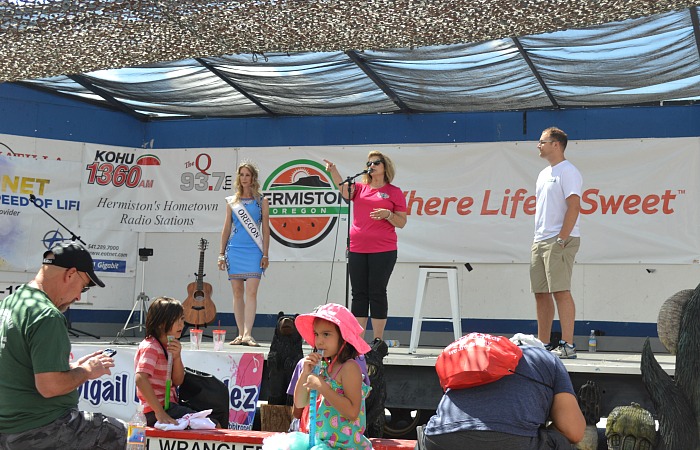
Find the location of a particular element. Image resolution: width=700 pixels, height=450 pixels. see thru ceiling fabric is located at coordinates (314, 81), (192, 90), (624, 60), (463, 78).